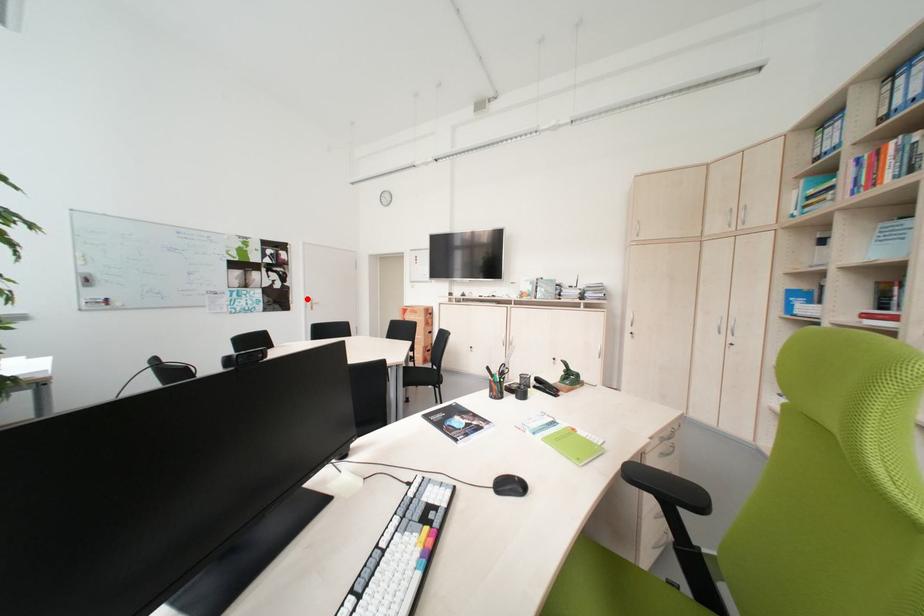
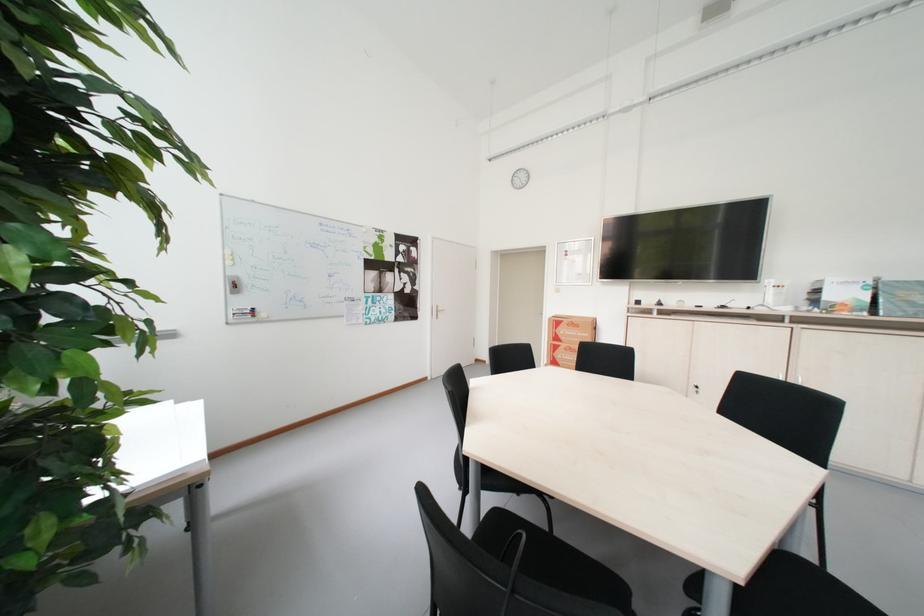
Question: I am providing you with two images of the same scene from different viewpoints. A red point is shown in image1. For the corresponding object point in image2, is it positioned nearer or farther from the camera?

Choices:
 (A) Nearer
 (B) Farther

Answer: (B)